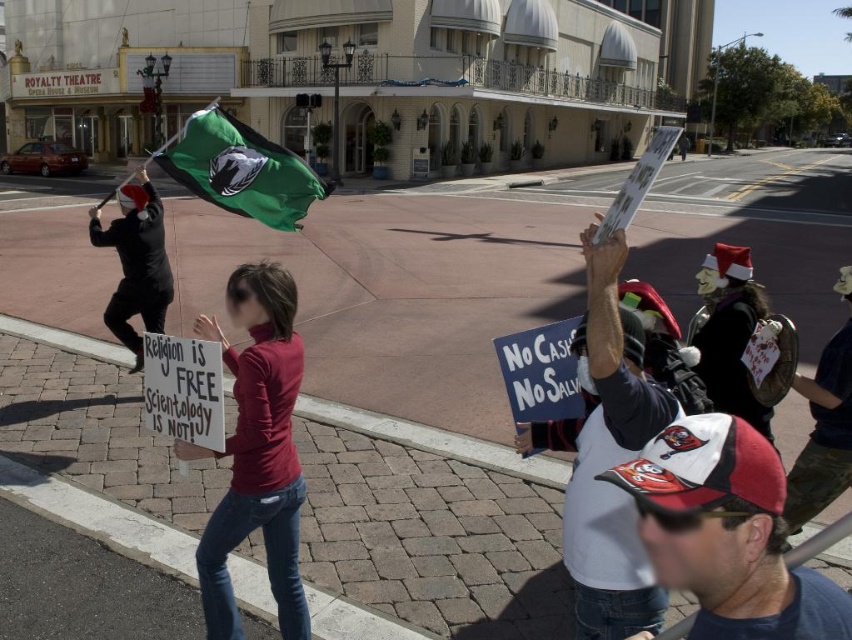
Question: Does santa hat at upper right have a larger size compared to camouflage-patterned pants at lower right?

Choices:
 (A) yes
 (B) no

Answer: (B)

Question: Does matte red shirt at center have a lesser width compared to santa hat at upper right?

Choices:
 (A) yes
 (B) no

Answer: (B)

Question: Which object appears farthest from the camera in this image?

Choices:
 (A) matte red shirt at center
 (B) white fabric cap at center
 (C) camouflage-patterned pants at lower right

Answer: (C)

Question: Does white fabric cap at center have a smaller size compared to green fabric flag at upper left?

Choices:
 (A) yes
 (B) no

Answer: (A)

Question: Among these objects, which one is farthest from the camera?

Choices:
 (A) black matte flag at left
 (B) santa hat at upper right
 (C) white fabric cap at center
 (D) green fabric flag at upper left

Answer: (A)

Question: Among these points, which one is nearest to the camera?

Choices:
 (A) (790, 596)
 (B) (266, 161)
 (C) (147, 326)
 (D) (741, 372)

Answer: (A)